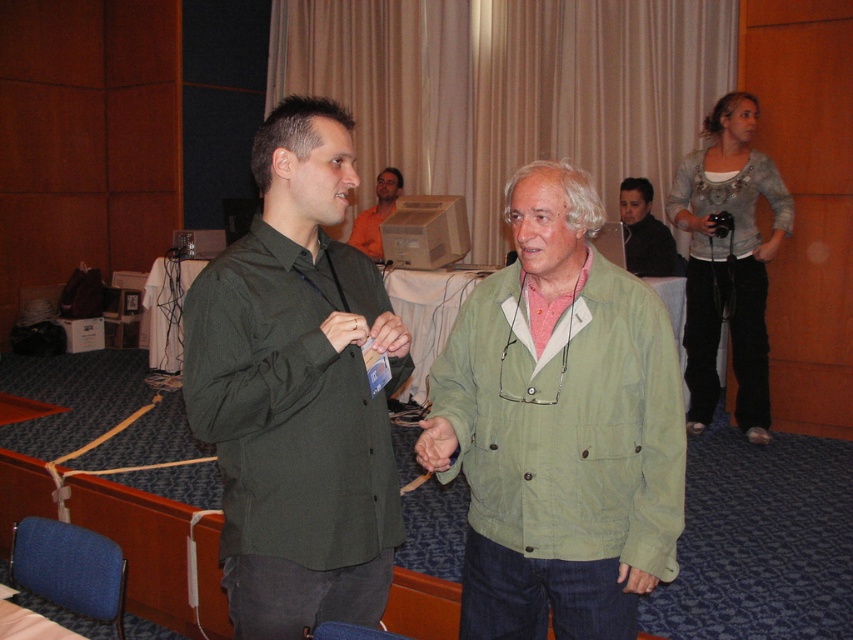
Question: Which point is closer to the camera?

Choices:
 (A) (670, 275)
 (B) (573, 340)
 (C) (300, 352)

Answer: (C)

Question: Which object is positioned closest to the dark gray jacket at upper right?

Choices:
 (A) green fabric jacket at center
 (B) green matte shirt at center
 (C) orange shirt at upper center

Answer: (C)

Question: Does green fabric jacket at center have a greater width compared to dark gray jacket at upper right?

Choices:
 (A) yes
 (B) no

Answer: (A)

Question: Does green matte shirt at center appear on the right side of green fabric jacket at center?

Choices:
 (A) yes
 (B) no

Answer: (B)

Question: Is green matte shirt at center smaller than green fabric jacket at center?

Choices:
 (A) no
 (B) yes

Answer: (A)

Question: Which of the following is the closest to the observer?

Choices:
 (A) (614, 432)
 (B) (653, 237)
 (C) (305, 252)

Answer: (C)